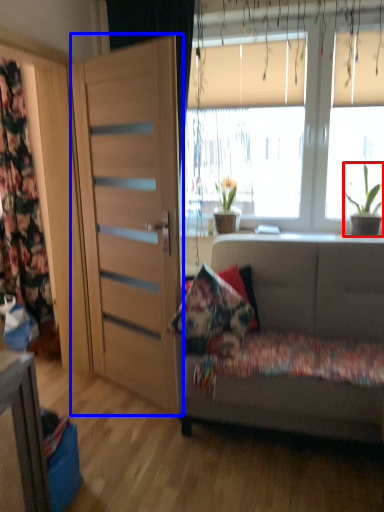
Question: Among these objects, which one is nearest to the camera, houseplant (highlighted by a red box) or door (highlighted by a blue box)?

Choices:
 (A) houseplant
 (B) door

Answer: (B)